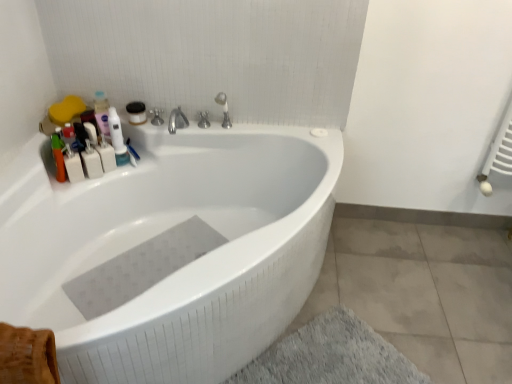
This screenshot has width=512, height=384. What are the coordinates of `free spot to the right of polished chrome faucet at upper center, placed as the first tap when sorted from left to right` in the screenshot? It's located at (232, 124).